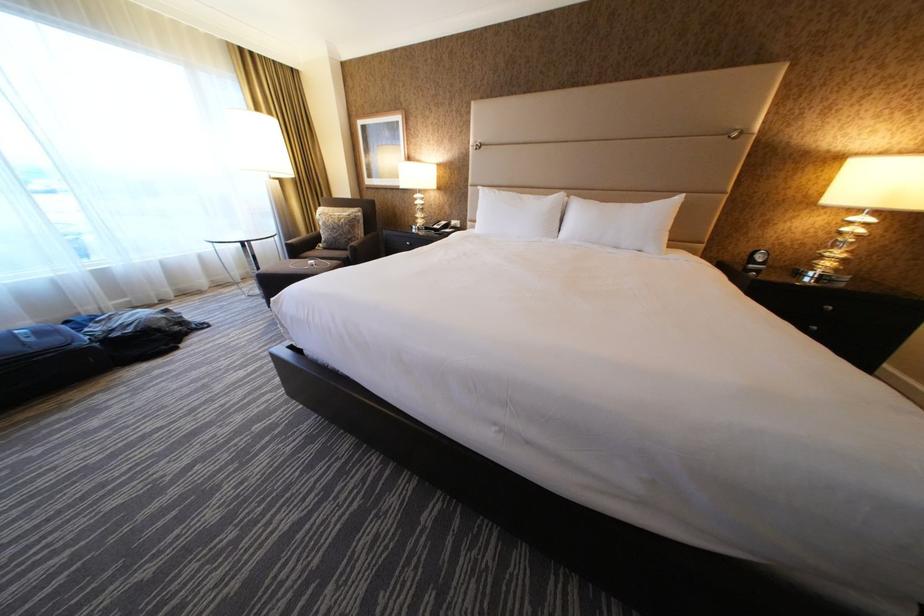
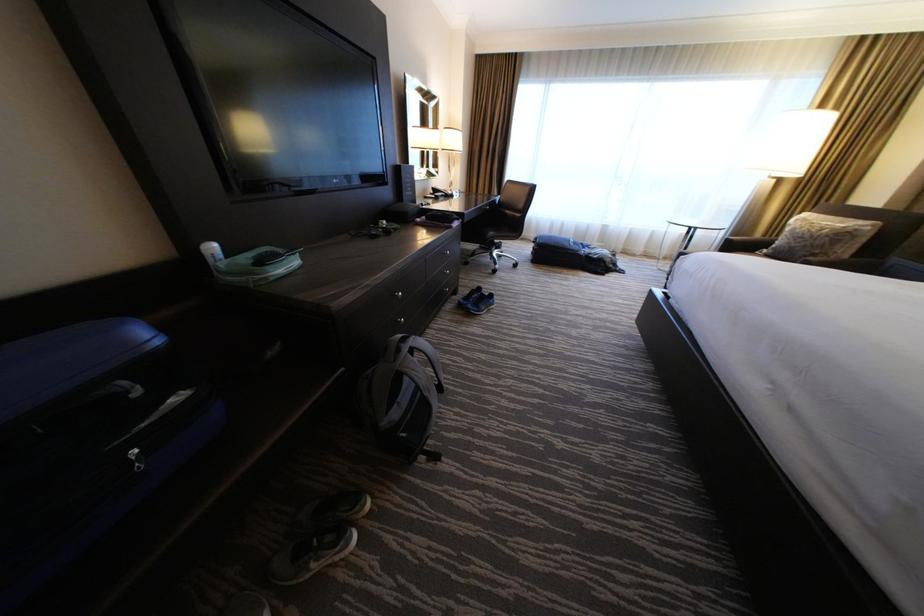
In the scene shown: First-person continuous shooting, in which direction is the camera rotating?

The rotation direction of the camera is left-down.